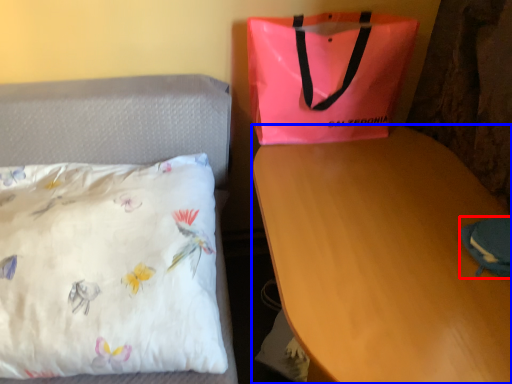
Question: Which object is further to the camera taking this photo, pouch (highlighted by a red box) or desk (highlighted by a blue box)?

Choices:
 (A) pouch
 (B) desk

Answer: (A)